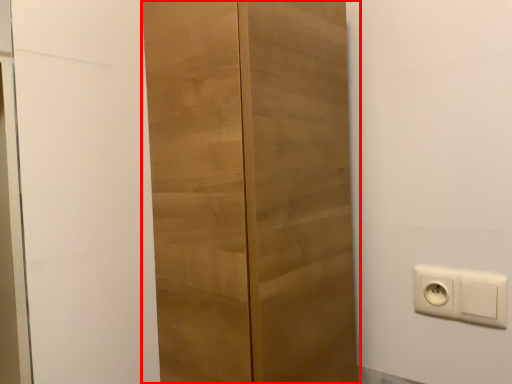
Question: From the image's perspective, what is the correct spatial relationship of cupboard (annotated by the red box) in relation to power plugs and sockets?

Choices:
 (A) above
 (B) below

Answer: (A)